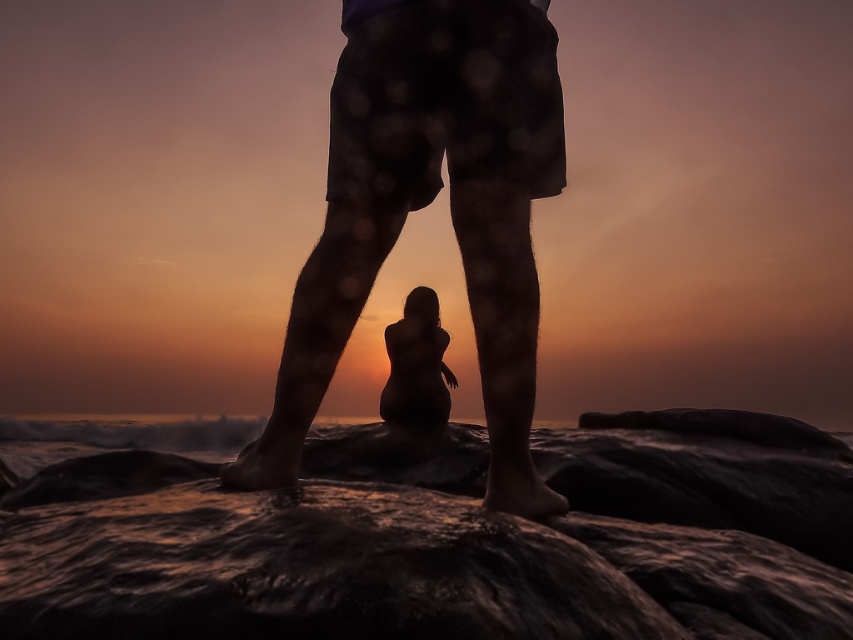
Is sandy water at lower center wider than silhouette shorts at center?

No.

Who is more forward, (x=409, y=452) or (x=492, y=56)?

Point (x=492, y=56)

Locate an element on the screen. The height and width of the screenshot is (640, 853). sandy water at lower center is located at coordinates (428, 540).

Measure the distance between sandy water at lower center and silhouette figure at center.

They are 10.46 feet apart.

Locate an element on the screen. sandy water at lower center is located at coordinates (428, 540).

Locate an element on the screen. The image size is (853, 640). sandy water at lower center is located at coordinates (428, 540).

Who is lower down, silhouette shorts at center or silhouette figure at center?

silhouette figure at center is below.

Between silhouette shorts at center and silhouette figure at center, which one has more height?

With more height is silhouette shorts at center.

Who is more distant from viewer, (469, 13) or (415, 364)?

Point (415, 364)

The image size is (853, 640). What are the coordinates of `silhouette shorts at center` in the screenshot? It's located at (427, 204).